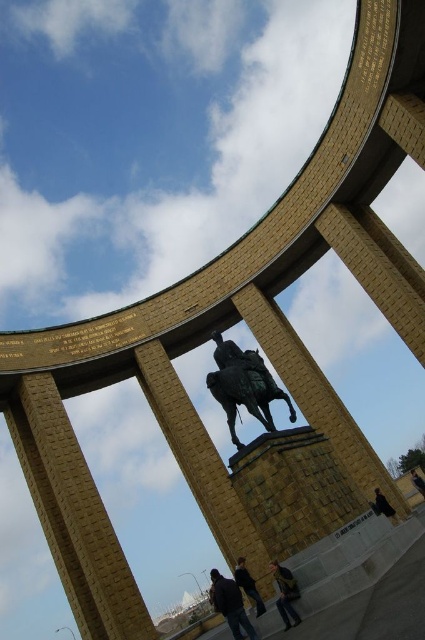
You are standing in front of the monument and want to take a photo of the shiny bronze horse at center. Where should you position yourself to capture the horse in the center of your camera frame?

The shiny bronze horse at center is located at point (x=243, y=385), so you should position yourself directly in front of the coordinates to ensure the horse is centered in your photo.

You are standing in front of the monument and notice the shiny bronze horse at center and the denim jacket at lower center. Which object is positioned to the right side from your perspective?

The denim jacket at lower center is positioned to the right side of the shiny bronze horse at center.